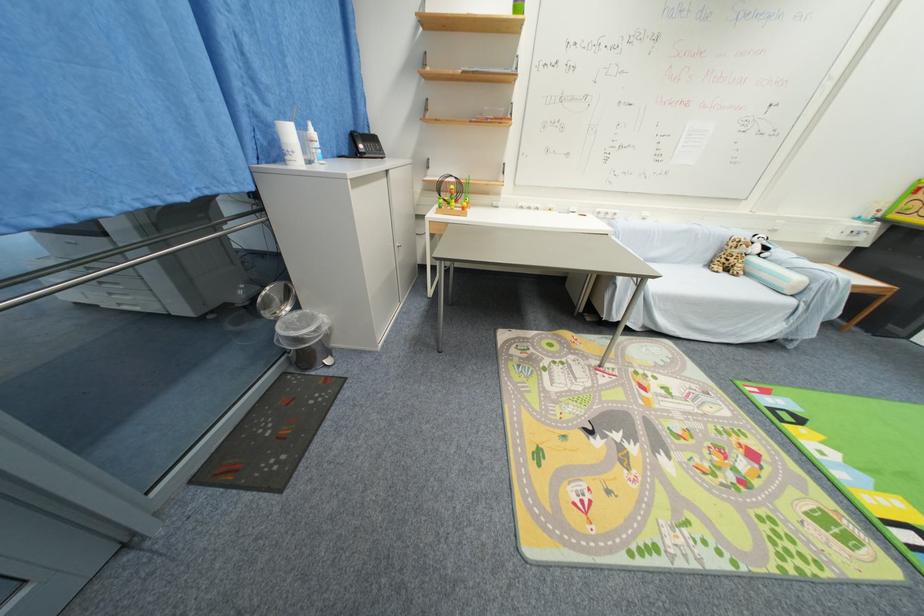
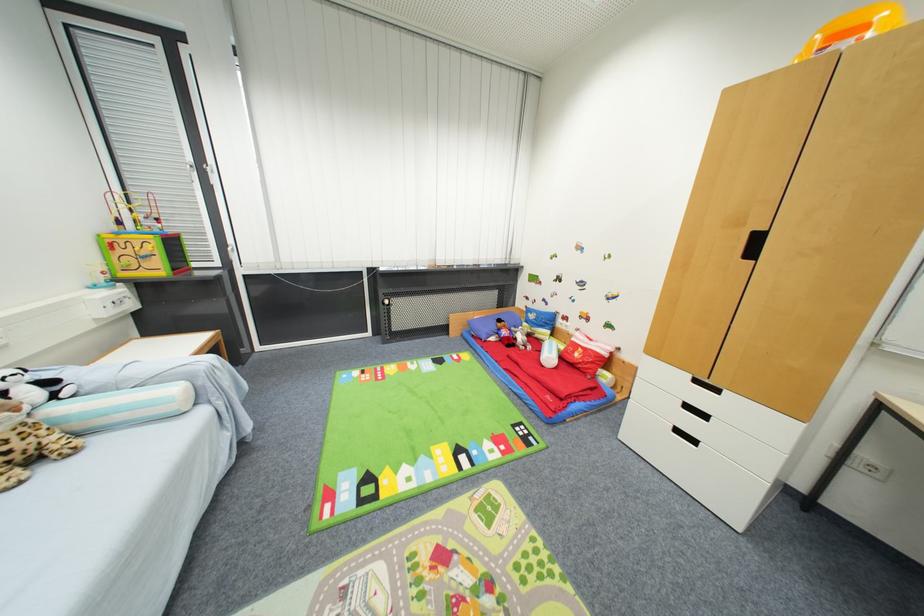
Find the pixel in the second image that matches [731,264] in the first image.

(7, 456)